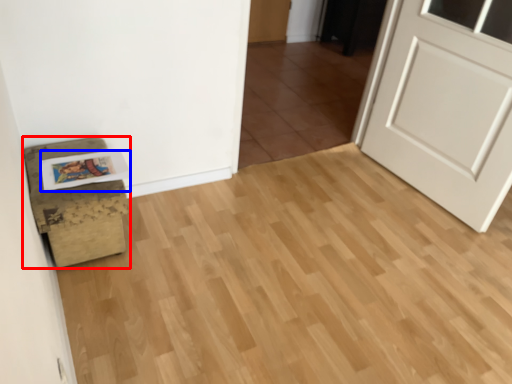
Question: Which point is closer to the camera, furniture (highlighted by a red box) or postcard (highlighted by a blue box)?

Choices:
 (A) furniture
 (B) postcard

Answer: (A)